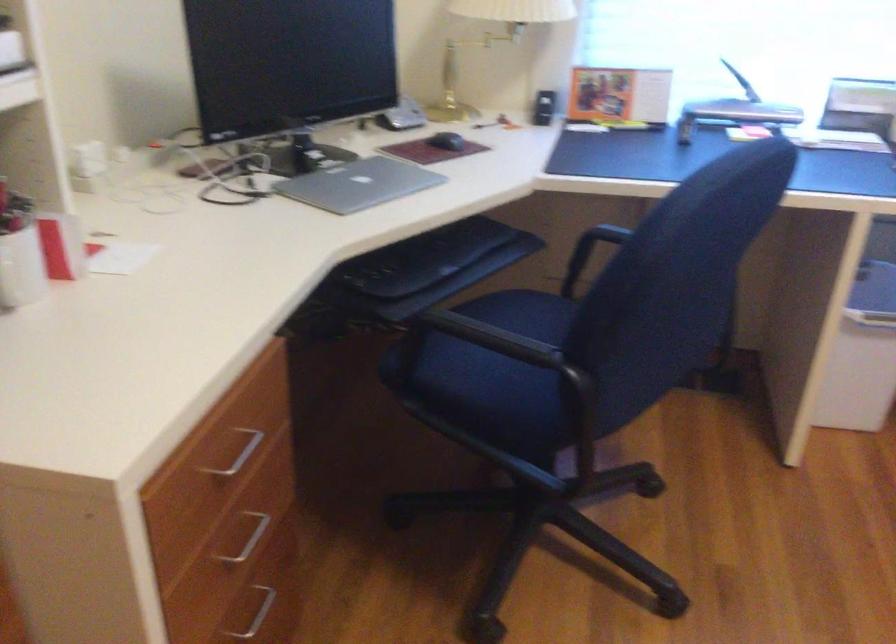
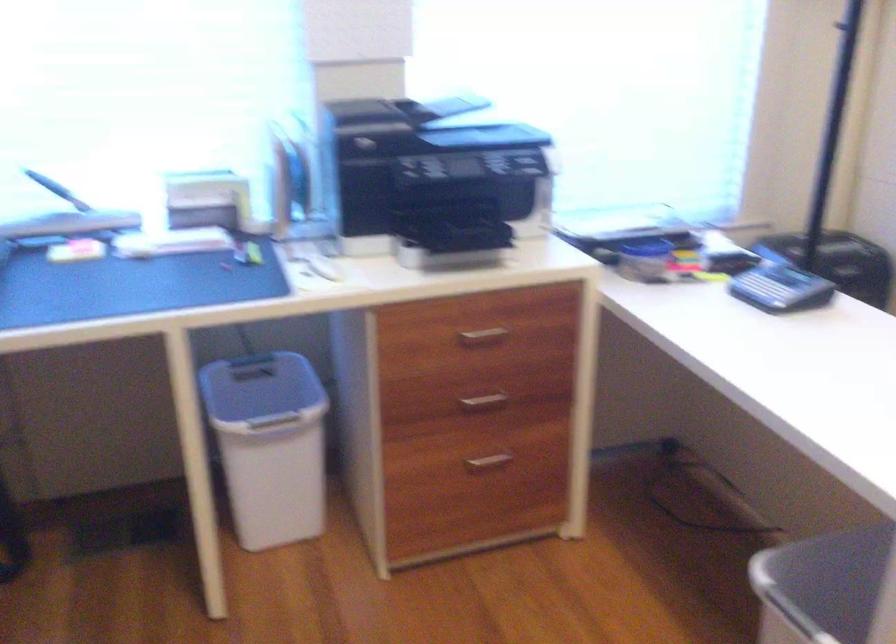
Question: The images are taken continuously from a first-person perspective. In which direction is your viewpoint rotating?

Choices:
 (A) Left
 (B) Right
 (C) Up
 (D) Down

Answer: (B)